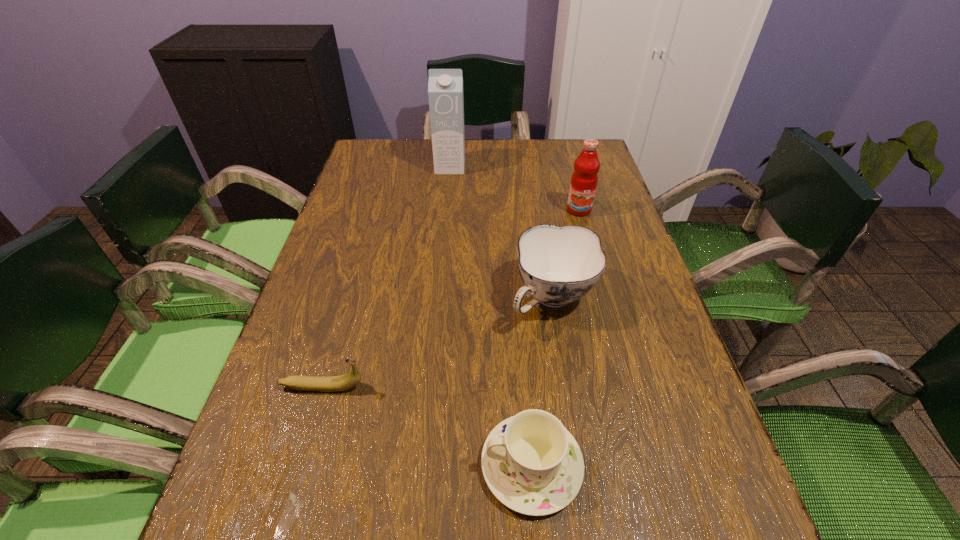
You are a GUI agent. You are given a task and a screenshot of the screen. Output one action in this format:
    pyautogui.click(x=<x>, y=<y>)
    Task: Click on the blank space that satisfies the following two spatial constraints: 1. on the front label of the second farthest object; 2. at the stem of the leftmost object
    
    Given the screenshot: What is the action you would take?
    pyautogui.click(x=628, y=387)

Locate an element on the screen. This screenshot has width=960, height=540. free space that satisfies the following two spatial constraints: 1. on the front label of the fourth shortest object; 2. at the stem of the leftmost object is located at coordinates (628, 387).

I want to click on vacant region that satisfies the following two spatial constraints: 1. on the front label of the fourth nearest object; 2. on the handle side of the shorter chinaware, so click(649, 465).

Where is `free point that satisfies the following two spatial constraints: 1. on the front label of the third nearest object; 2. on the left side of the farthest object`? The image size is (960, 540). free point that satisfies the following two spatial constraints: 1. on the front label of the third nearest object; 2. on the left side of the farthest object is located at coordinates (438, 299).

Find the location of a particular element. This screenshot has height=540, width=960. vacant space that satisfies the following two spatial constraints: 1. on the front label of the fruit juice; 2. at the stem of the banana is located at coordinates (628, 387).